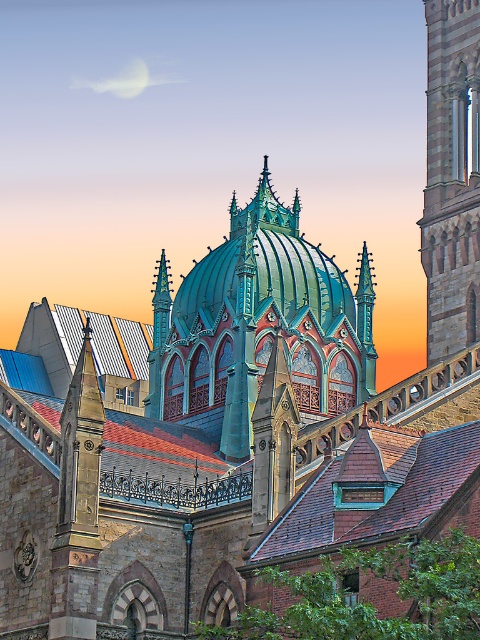
You are an architect examining this building design. You need to determine the spatial relationship between the teal metallic dome at center and the stone tower at right. Which object is located to the left of the other?

The teal metallic dome at center is positioned on the left side of stone tower at right.

You are an architect planning to install a new lighting system between the teal metallic dome at center and the stone tower at right. The system requires a minimum of 30 feet of space between the two structures for installation. Based on the scene, will the available distance be sufficient?

The teal metallic dome at center and the stone tower at right are 28.52 feet apart, which is less than the required 30 feet. Therefore, the available distance is insufficient for the lighting system installation.